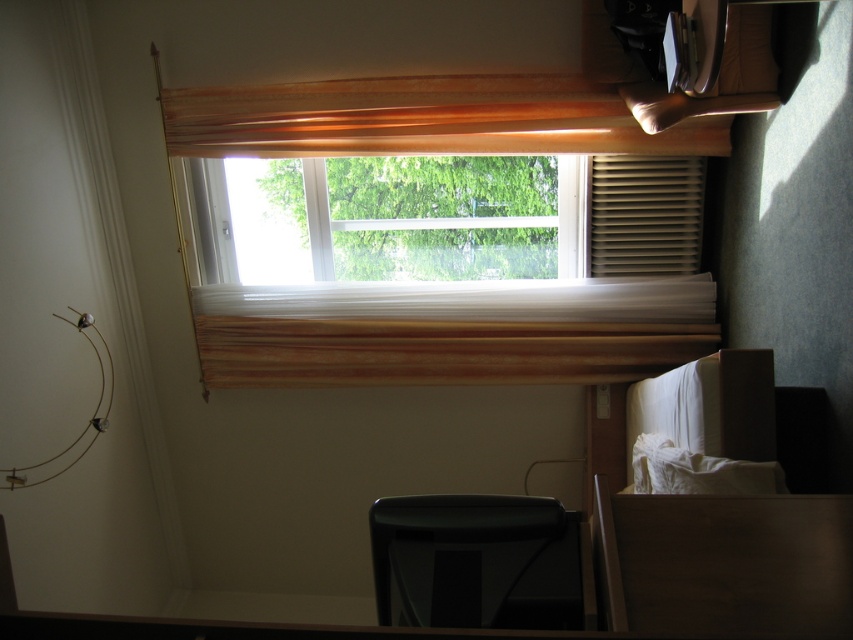
Does wooden blind at upper center have a larger size compared to matte brown blind at right?

Correct, wooden blind at upper center is larger in size than matte brown blind at right.

Which is more to the right, wooden blind at upper center or matte brown blind at right?

matte brown blind at right

Does point (492, 104) come farther from viewer compared to point (595, 252)?

No.

Where is `wooden blind at upper center`? The width and height of the screenshot is (853, 640). wooden blind at upper center is located at coordinates (422, 118).

Measure the distance between black plastic chair at lower center and matte brown blind at right.

The distance of black plastic chair at lower center from matte brown blind at right is 7.40 feet.

Is black plastic chair at lower center below matte brown blind at right?

Yes, black plastic chair at lower center is below matte brown blind at right.

This screenshot has height=640, width=853. In order to click on black plastic chair at lower center in this screenshot , I will do [476, 561].

Does point (300, 100) lie behind point (465, 621)?

That is True.

Is point (167, 88) less distant than point (579, 611)?

No, (167, 88) is further to viewer.

Describe the element at coordinates (422, 118) in the screenshot. The height and width of the screenshot is (640, 853). I see `wooden blind at upper center` at that location.

Where is `wooden blind at upper center`? Image resolution: width=853 pixels, height=640 pixels. wooden blind at upper center is located at coordinates (422, 118).